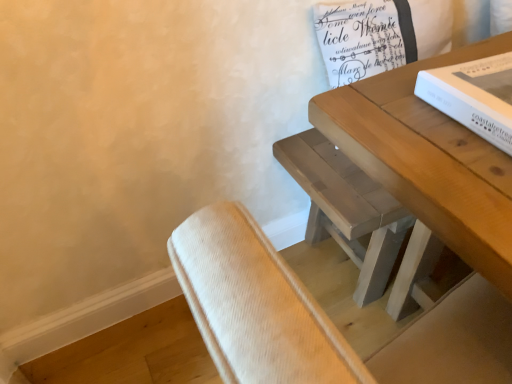
What do you see at coordinates (474, 96) in the screenshot? The height and width of the screenshot is (384, 512). I see `white matte paperback book at upper right` at bounding box center [474, 96].

I want to click on white matte paperback book at upper right, so click(x=474, y=96).

In order to click on white matte paperback book at upper right in this screenshot , I will do `click(474, 96)`.